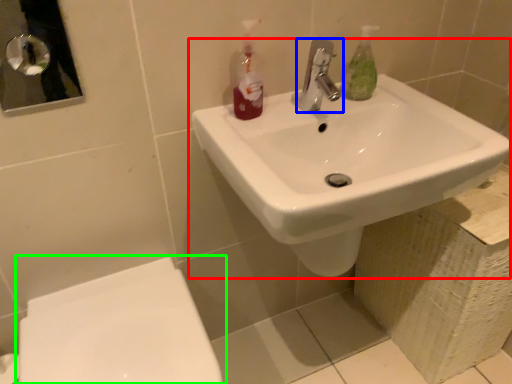
Question: Considering the real-world distances, which object is closest to sink (highlighted by a red box)? tap (highlighted by a blue box) or toilet (highlighted by a green box).

Choices:
 (A) tap
 (B) toilet

Answer: (A)